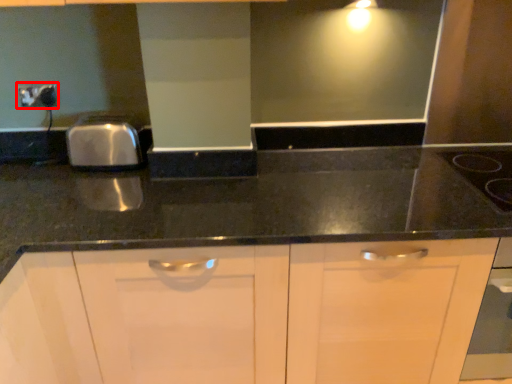
Question: In this image, where is electric outlet (annotated by the red box) located relative to gas stove?

Choices:
 (A) left
 (B) right

Answer: (A)